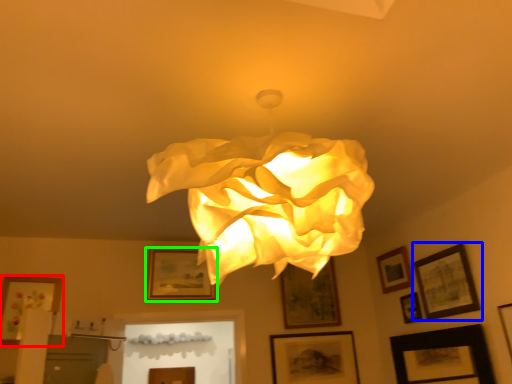
Question: Considering the real-world distances, which object is farthest from picture frame (highlighted by a red box)? picture frame (highlighted by a blue box) or picture frame (highlighted by a green box)?

Choices:
 (A) picture frame
 (B) picture frame

Answer: (A)